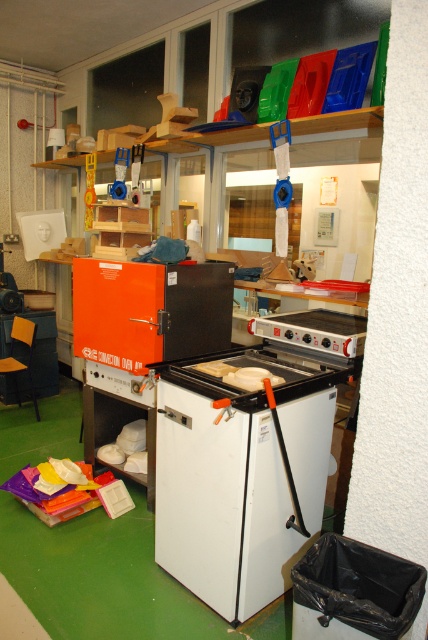
Question: Is white matte refrigerator at center closer to camera compared to orange matte oven at center?

Choices:
 (A) yes
 (B) no

Answer: (A)

Question: Which object appears closest to the camera in this image?

Choices:
 (A) orange matte oven at center
 (B) white matte refrigerator at center

Answer: (B)

Question: Observing the image, what is the correct spatial positioning of white matte refrigerator at center in reference to orange matte oven at center?

Choices:
 (A) right
 (B) left

Answer: (A)

Question: Does white matte refrigerator at center appear on the left side of orange matte oven at center?

Choices:
 (A) no
 (B) yes

Answer: (A)

Question: Which point is closer to the camera taking this photo?

Choices:
 (A) (180, 566)
 (B) (139, 269)

Answer: (A)

Question: Which point appears closest to the camera in this image?

Choices:
 (A) (193, 330)
 (B) (252, 422)

Answer: (B)